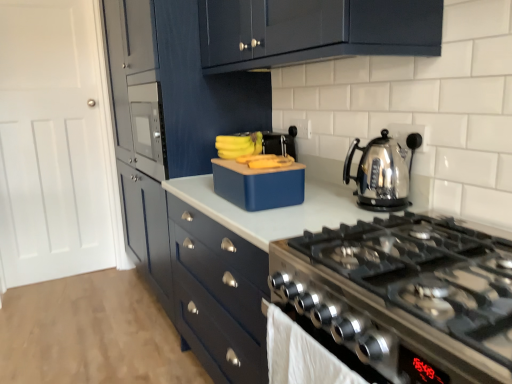
Image resolution: width=512 pixels, height=384 pixels. What are the coordinates of `vacant space in front of blue matte lunchbox at center` in the screenshot? It's located at (293, 214).